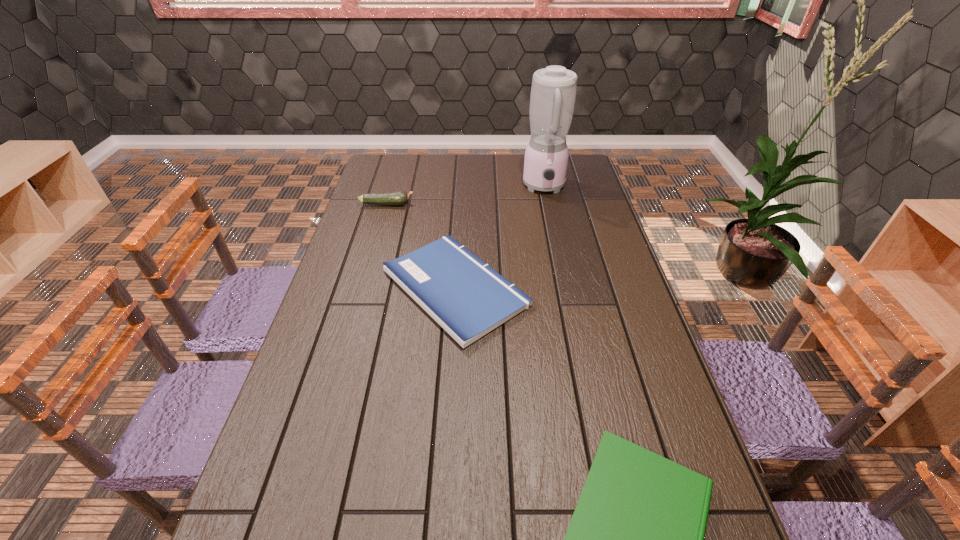
The image size is (960, 540). Find the location of `object that is at the far right corner`. object that is at the far right corner is located at coordinates (553, 92).

Image resolution: width=960 pixels, height=540 pixels. Identify the location of blank space at the far edge of the desktop. (489, 156).

At what (x,y) coordinates should I click in order to perform the action: click on free point at the left edge. Please return your answer as a coordinate pair (x, y). This screenshot has height=540, width=960. Looking at the image, I should click on (368, 218).

Identify the location of vacant space at the right edge of the desktop. (610, 228).

Find the location of `free point at the far left corner`. free point at the far left corner is located at coordinates (382, 167).

Identify the location of free region at the far right corner of the desktop. (583, 163).

You are a GUI agent. You are given a task and a screenshot of the screen. Output one action in this format:
    pyautogui.click(x=<x>, y=<y>)
    Task: Click on the vacant region between the farther paperback book and the food processor
    The width and height of the screenshot is (960, 540).
    Given the screenshot: What is the action you would take?
    pyautogui.click(x=500, y=238)

Identify the location of free space between the farther paperback book and the food processor. (500, 238).

This screenshot has height=540, width=960. What are the coordinates of `vacant area between the farther paperback book and the tallest object` in the screenshot? It's located at (500, 238).

In order to click on free spot between the second nearest object and the food processor in this screenshot , I will do `click(500, 238)`.